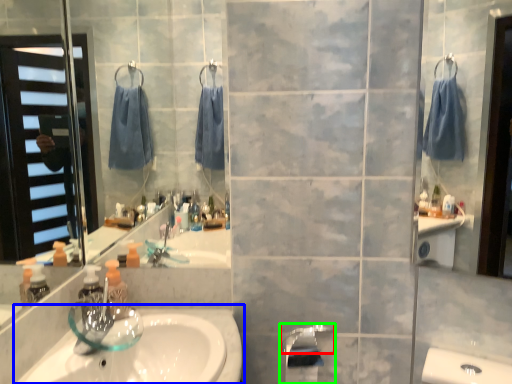
Question: Based on their relative distances, which object is nearer to faucet (highlighted by a red box)? Choose from sink (highlighted by a blue box) and tap (highlighted by a green box).

Choices:
 (A) sink
 (B) tap

Answer: (B)